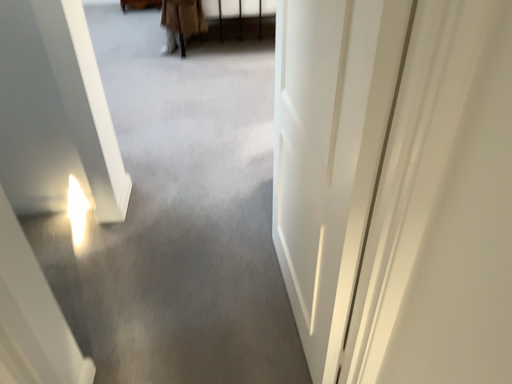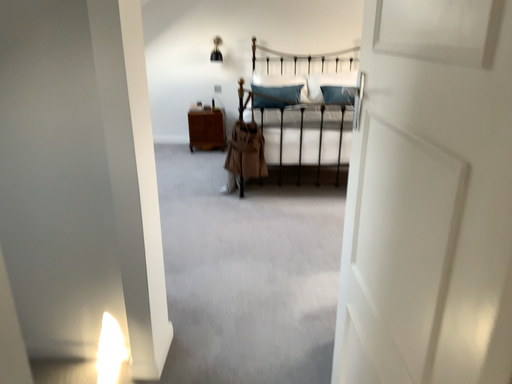
Question: How did the camera likely rotate when shooting the video?

Choices:
 (A) rotated downward
 (B) rotated upward

Answer: (B)